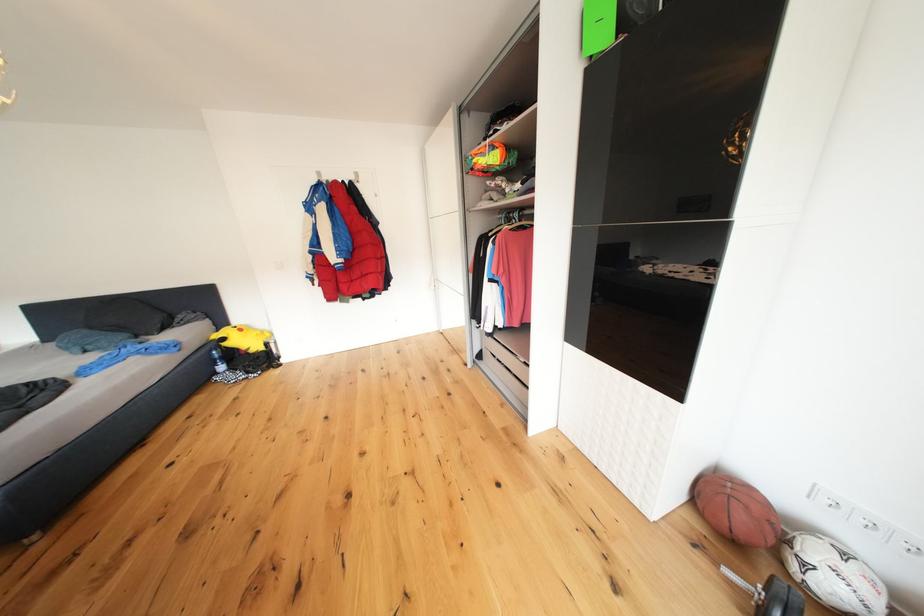
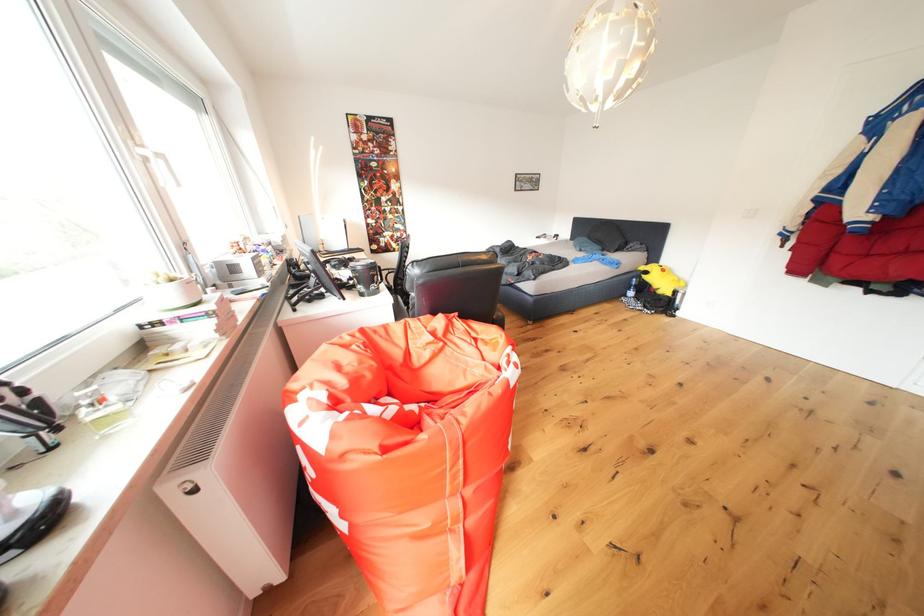
How did the camera likely rotate?

The camera's rotation is toward left-down.